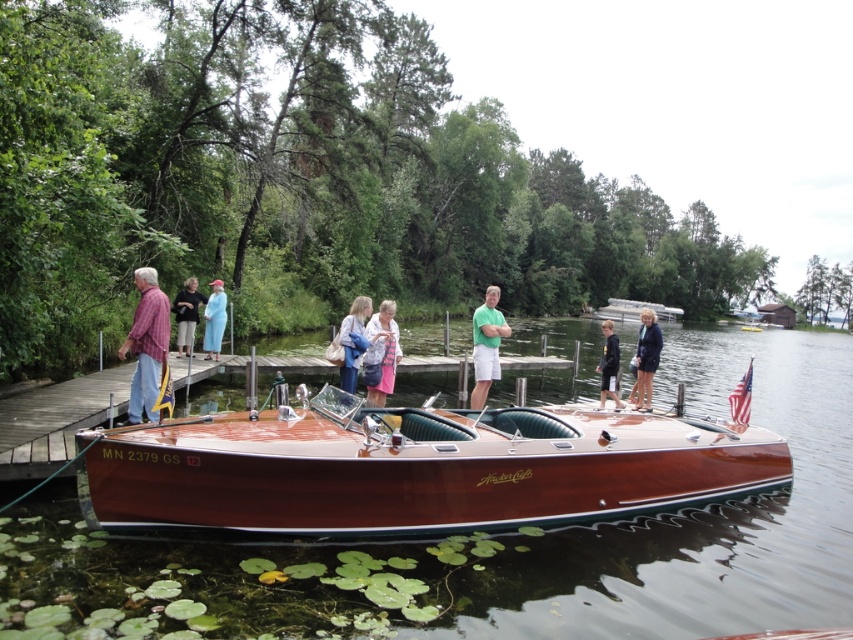
Is green matte shirt at center smaller than light pink fabric at center?

No.

Is green matte shirt at center wider than light pink fabric at center?

Indeed, green matte shirt at center has a greater width compared to light pink fabric at center.

Who is more distant from viewer, (474, 328) or (375, 330)?

Point (474, 328)

At what (x,y) coordinates should I click in order to perform the action: click on green matte shirt at center. Please return your answer as a coordinate pair (x, y). Looking at the image, I should click on (486, 344).

Can you confirm if wooden boat at center is positioned above matte red shirt at left?

Incorrect, wooden boat at center is not positioned above matte red shirt at left.

Is point (669, 372) closer to viewer compared to point (132, 403)?

No, it is not.

Find the location of a particular element. This screenshot has height=640, width=853. wooden boat at center is located at coordinates (508, 541).

Who is positioned more to the left, matte red shirt at left or black cotton jacket at center?

matte red shirt at left is more to the left.

Does matte red shirt at left have a lesser height compared to black cotton jacket at center?

Correct, matte red shirt at left is not as tall as black cotton jacket at center.

Between point (138, 316) and point (601, 369), which one is positioned in front?

Point (138, 316) is in front.

Locate an element on the screen. The height and width of the screenshot is (640, 853). matte red shirt at left is located at coordinates tap(146, 346).